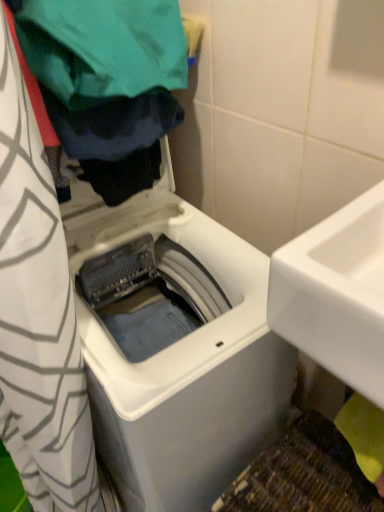
Question: From the image's perspective, would you say white plastic washing machine at center is shown under green fabric at upper left?

Choices:
 (A) yes
 (B) no

Answer: (A)

Question: Is white plastic washing machine at center further to the viewer compared to green fabric at upper left?

Choices:
 (A) no
 (B) yes

Answer: (B)

Question: Considering the relative positions of white plastic washing machine at center and green fabric at upper left in the image provided, is white plastic washing machine at center in front of green fabric at upper left?

Choices:
 (A) yes
 (B) no

Answer: (B)

Question: Is white plastic washing machine at center not within green fabric at upper left?

Choices:
 (A) no
 (B) yes

Answer: (B)

Question: Does white plastic washing machine at center appear on the left side of green fabric at upper left?

Choices:
 (A) yes
 (B) no

Answer: (B)

Question: From a real-world perspective, is white plastic washing machine at center under green fabric at upper left?

Choices:
 (A) no
 (B) yes

Answer: (B)

Question: Is green fabric at upper left not within white plastic washing machine at center?

Choices:
 (A) no
 (B) yes

Answer: (B)

Question: Can you confirm if green fabric at upper left is shorter than white plastic washing machine at center?

Choices:
 (A) yes
 (B) no

Answer: (A)

Question: From the image's perspective, is green fabric at upper left under white plastic washing machine at center?

Choices:
 (A) yes
 (B) no

Answer: (B)

Question: Is green fabric at upper left with white plastic washing machine at center?

Choices:
 (A) yes
 (B) no

Answer: (B)

Question: Considering the relative sizes of green fabric at upper left and white plastic washing machine at center in the image provided, is green fabric at upper left smaller than white plastic washing machine at center?

Choices:
 (A) no
 (B) yes

Answer: (B)

Question: Is green fabric at upper left thinner than white plastic washing machine at center?

Choices:
 (A) no
 (B) yes

Answer: (B)

Question: Does green fabric at upper left have a lesser width compared to white glossy sink at right?

Choices:
 (A) no
 (B) yes

Answer: (B)